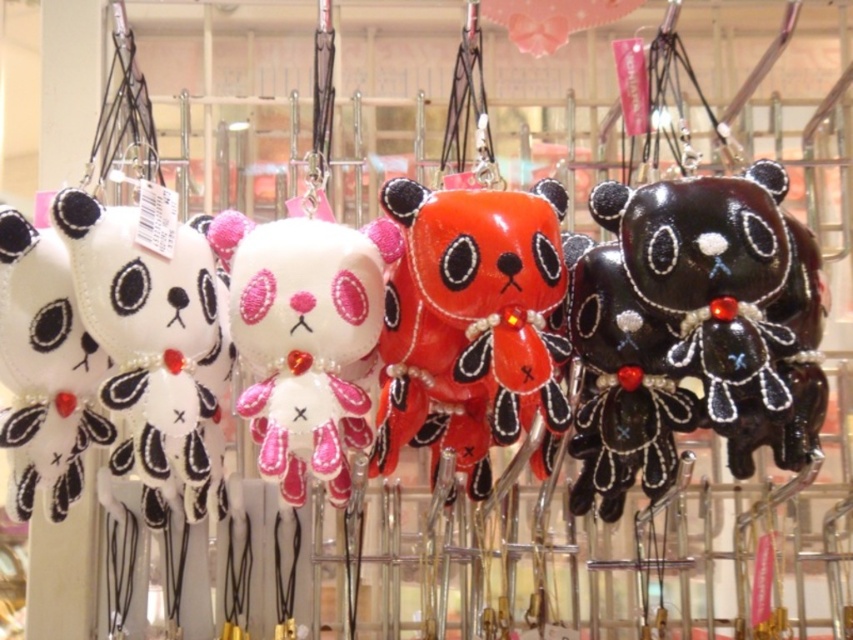
Consider the image. You are a customer in the store and want to choose between the shiny orange plush bear at center and the matte black plush bear at left. Which one has a larger width?

The shiny orange plush bear at center is wider than the matte black plush bear at left according to the description provided.

You are a customer in the store looking at the glossy black bear at right and the matte black plush bear at left. Which one is wider?

The glossy black bear at right might be wider than matte black plush bear at left.

You are standing 2 meters away from the metal rack. Can you reach the point at coordinates point (769,442)?

The point at coordinates point (769,442) is 1.04 meters from the camera, so yes, you can reach it since it is closer than your standing distance of 2 meters.